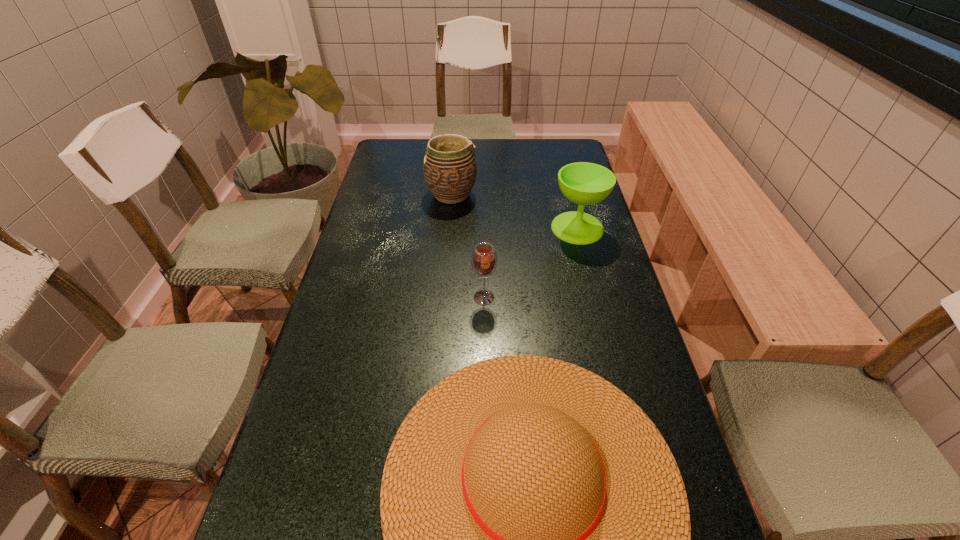
In the image, there is a desktop. Find the location of `free region at the left edge`. free region at the left edge is located at coordinates (360, 245).

The image size is (960, 540). Find the location of `free space at the right edge of the desktop`. free space at the right edge of the desktop is located at coordinates (613, 322).

Find the location of a particular element. Image resolution: width=960 pixels, height=540 pixels. vacant space at the far left corner of the desktop is located at coordinates point(410,164).

Locate an element on the screen. The width and height of the screenshot is (960, 540). vacant point at the far right corner is located at coordinates (540, 146).

I want to click on blank region between the right wineglass and the pottery, so click(515, 212).

Identify the location of empty space between the pottery and the right wineglass. (515, 212).

Where is `vacant area that lies between the pottery and the nearer wineglass`? This screenshot has width=960, height=540. vacant area that lies between the pottery and the nearer wineglass is located at coordinates 468,246.

Locate an element on the screen. object that stands as the third closest to the nearest object is located at coordinates (449, 167).

Locate which object is the closest to the nearest object. Please provide its 2D coordinates. Your answer should be formatted as a tuple, i.e. [(x, y)], where the tuple contains the x and y coordinates of a point satisfying the conditions above.

[(484, 259)]